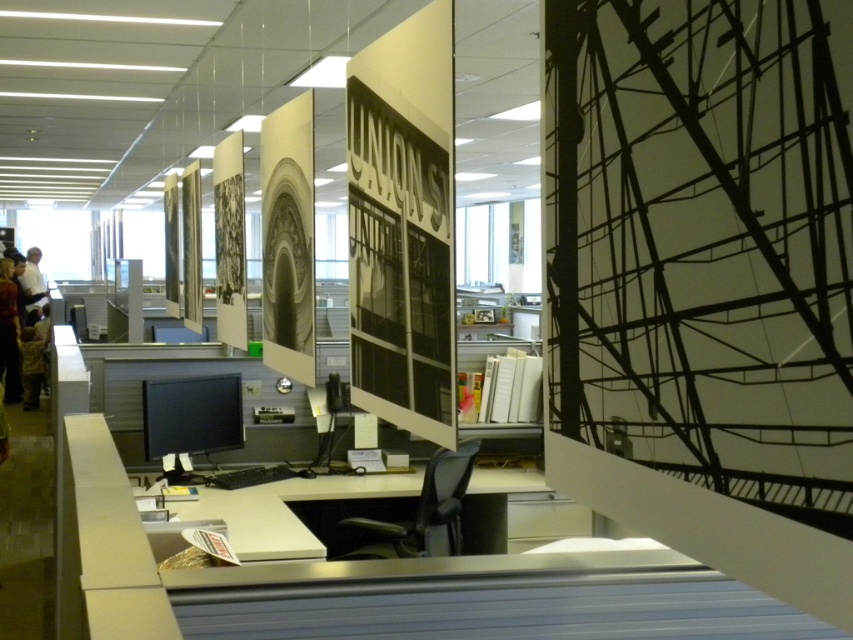
You are a GUI agent. You are given a task and a screenshot of the screen. Output one action in this format:
    pyautogui.click(x=<x>, y=<y>)
    Task: Click on the metallic silver sign at center
    The height and width of the screenshot is (640, 853).
    Given the screenshot: What is the action you would take?
    399,264

Who is higher up, metallic silver sign at center or camouflage uniform at left?

metallic silver sign at center is above.

Is point (363, 83) positioned in front of point (39, 385)?

Yes.

The width and height of the screenshot is (853, 640). In order to click on metallic silver sign at center in this screenshot , I will do `click(399, 264)`.

Consider the image. Does matte black monitor at center have a smaller size compared to white glossy pillar at center?

Correct, matte black monitor at center occupies less space than white glossy pillar at center.

Who is shorter, matte black monitor at center or white glossy pillar at center?

With less height is matte black monitor at center.

Where is `matte black monitor at center`? The image size is (853, 640). matte black monitor at center is located at coordinates [x=190, y=419].

The height and width of the screenshot is (640, 853). I want to click on matte black monitor at center, so click(x=190, y=419).

Who is more forward, (x=427, y=410) or (x=131, y=273)?

Point (x=427, y=410) is in front.

Looking at this image, does metallic silver sign at center appear on the left side of white glossy pillar at center?

Incorrect, metallic silver sign at center is not on the left side of white glossy pillar at center.

Is point (369, 282) more distant than point (132, 317)?

No, (369, 282) is closer to viewer.

You are a GUI agent. You are given a task and a screenshot of the screen. Output one action in this format:
    pyautogui.click(x=<x>, y=<y>)
    Task: Click on the metallic silver sign at center
    
    Given the screenshot: What is the action you would take?
    pyautogui.click(x=399, y=264)